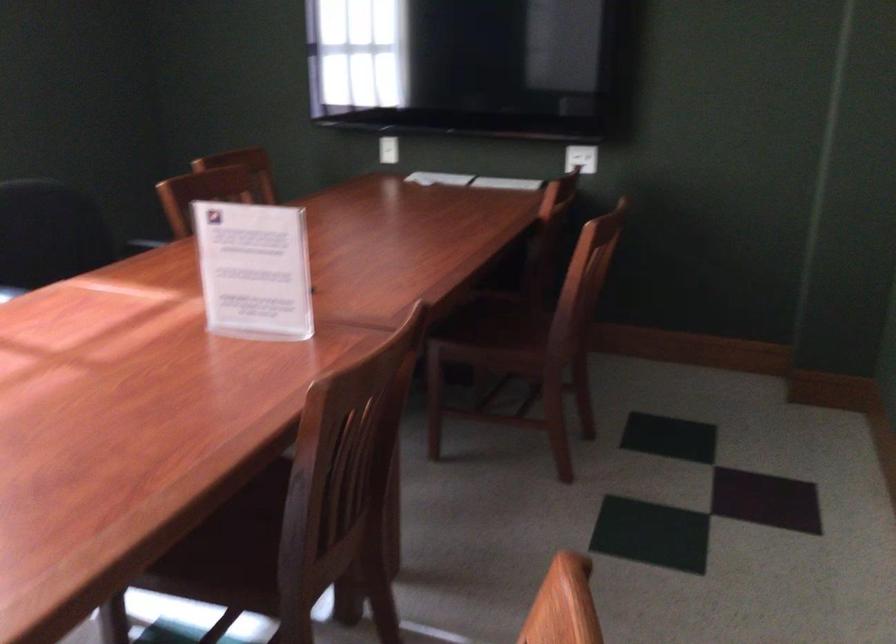
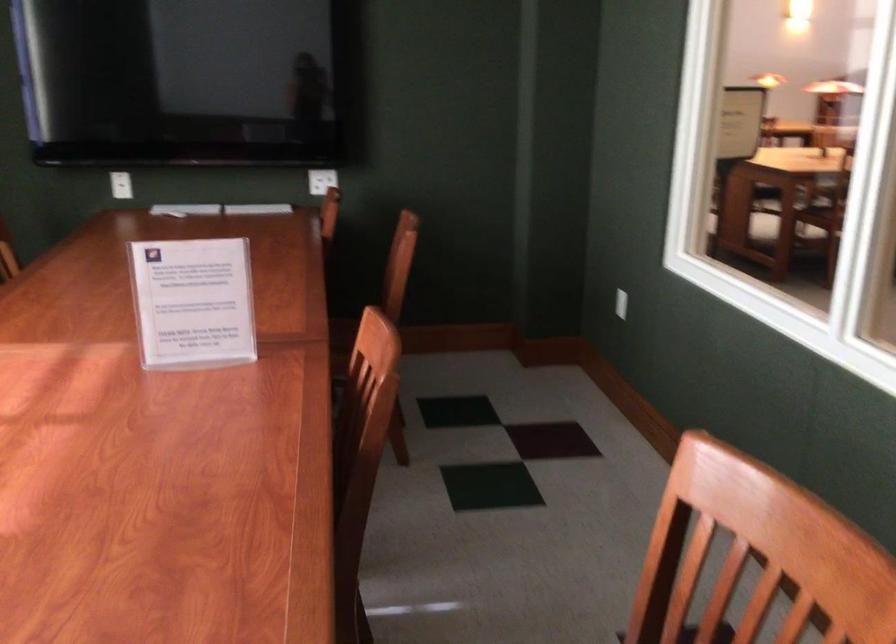
Locate, in the second image, the point that corresponds to (x=246, y=268) in the first image.

(193, 303)